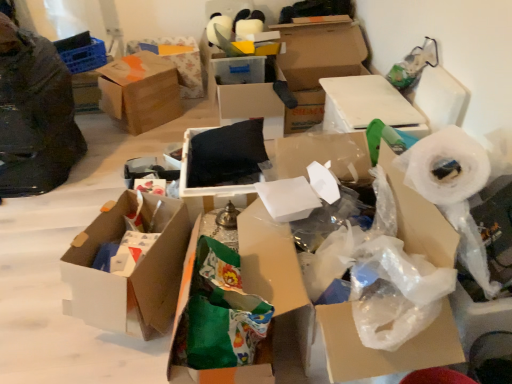
How much space does cardboard box at upper center, which ranks as the second box in right-to-left order, occupy vertically?

cardboard box at upper center, which ranks as the second box in right-to-left order, is 54.04 centimeters in height.

The width and height of the screenshot is (512, 384). Describe the element at coordinates (453, 190) in the screenshot. I see `white plastic roll at right` at that location.

Measure the distance between point (182, 195) and camera.

Point (182, 195) and camera are 6.27 feet apart.

What is the approximate height of white cardboard box at center, which appears as the sixth box when viewed from the left?

It is 15.74 inches.

What is the approximate width of white cardboard box at center, positioned as the 6th box in right-to-left order?

white cardboard box at center, positioned as the 6th box in right-to-left order, is 12.50 inches wide.

The image size is (512, 384). I want to click on brown cardboard box at upper left, marked as the eighth box in a right-to-left arrangement, so click(140, 92).

This screenshot has width=512, height=384. Identify the location of cardboard box at upper center, which ranks as the second box in right-to-left order. (317, 64).

The image size is (512, 384). In order to click on the 3rd box behind the dark green fabric at left in this screenshot , I will do `click(248, 103)`.

From a real-world perspective, is white cardboard box at center, which ranks as the third box in right-to-left order, above or below dark green fabric at left?

From a real-world perspective, white cardboard box at center, which ranks as the third box in right-to-left order, is physically below dark green fabric at left.

Relative to dark green fabric at left, is white cardboard box at center, which ranks as the third box in right-to-left order, in front or behind?

Clearly, white cardboard box at center, which ranks as the third box in right-to-left order, is behind dark green fabric at left.

Is cardboard box at center further to camera compared to green fabric bag at center, acting as the 5th box starting from the left?

No, cardboard box at center is in front of green fabric bag at center, acting as the 5th box starting from the left.

From the image's perspective, between cardboard box at center and green fabric bag at center, acting as the 5th box starting from the left, who is located below?

green fabric bag at center, acting as the 5th box starting from the left, is shown below in the image.

Does cardboard box at center appear on the left side of green fabric bag at center, which ranks as the 4th box in right-to-left order?

No, cardboard box at center is not to the left of green fabric bag at center, which ranks as the 4th box in right-to-left order.

Does point (234, 369) appear closer or farther from the camera than point (407, 235)?

Point (234, 369) is positioned closer to the camera compared to point (407, 235).

Is green fabric bag at center, which ranks as the 4th box in right-to-left order, taller than cardboard box at center?

In fact, green fabric bag at center, which ranks as the 4th box in right-to-left order, may be shorter than cardboard box at center.

Is the surface of green fabric bag at center, which ranks as the 4th box in right-to-left order, in direct contact with cardboard box at center?

No, green fabric bag at center, which ranks as the 4th box in right-to-left order, is not making contact with cardboard box at center.

Between green fabric bag at center, acting as the 5th box starting from the left, and cardboard box at center, which one has smaller size?

green fabric bag at center, acting as the 5th box starting from the left.

Is white cardboard box at center, which ranks as the third box in right-to-left order, positioned with its back to cardboard box at upper center, which ranks as the second box in right-to-left order?

No, white cardboard box at center, which ranks as the third box in right-to-left order,'s orientation is not away from cardboard box at upper center, which ranks as the second box in right-to-left order.

In terms of width, does white cardboard box at center, which appears as the sixth box when viewed from the left, look wider or thinner when compared to cardboard box at upper center, which ranks as the second box in right-to-left order?

In the image, white cardboard box at center, which appears as the sixth box when viewed from the left, appears to be more narrow than cardboard box at upper center, which ranks as the second box in right-to-left order.

Considering the positions of point (269, 114) and point (296, 60), is point (269, 114) closer or farther from the camera than point (296, 60)?

Point (269, 114) appears to be closer to the viewer than point (296, 60).

Is white cardboard box at center, which ranks as the third box in right-to-left order, next to cardboard box at upper center, which ranks as the second box in right-to-left order, and touching it?

No, white cardboard box at center, which ranks as the third box in right-to-left order, is not beside cardboard box at upper center, which ranks as the second box in right-to-left order.

Considering the sizes of objects white plastic roll at right and cardboard box at center in the image provided, who is thinner, white plastic roll at right or cardboard box at center?

With smaller width is white plastic roll at right.

Considering the relative positions of white plastic roll at right and cardboard box at center in the image provided, is white plastic roll at right in front of cardboard box at center?

No, white plastic roll at right is behind cardboard box at center.

This screenshot has width=512, height=384. Identify the location of cardboard box on the left of white plastic roll at right. (329, 310).

Can you confirm if white plastic roll at right is positioned to the right of cardboard box at center?

Yes, white plastic roll at right is to the right of cardboard box at center.

Visually, is black matte pillow at center, acting as the 4th box starting from the left, positioned to the left or to the right of white cardboard box at center, which is counted as the third box, starting from the left?

black matte pillow at center, acting as the 4th box starting from the left, is positioned on white cardboard box at center, which is counted as the third box, starting from the left,'s right side.

Is point (195, 188) in front of point (151, 284)?

No, it is not.

Is white cardboard box at center, positioned as the 6th box in right-to-left order, at the back of black matte pillow at center, acting as the 4th box starting from the left?

No, black matte pillow at center, acting as the 4th box starting from the left, is not facing the opposite direction of white cardboard box at center, positioned as the 6th box in right-to-left order.

Is dark green fabric at left closer to camera compared to black matte pillow at center, the 5th box from the right?

That is True.

Considering the sizes of dark green fabric at left and black matte pillow at center, the 5th box from the right, in the image, is dark green fabric at left wider or thinner than black matte pillow at center, the 5th box from the right,?

dark green fabric at left is wider than black matte pillow at center, the 5th box from the right.

Is dark green fabric at left shorter than black matte pillow at center, the 5th box from the right?

No.

Does dark green fabric at left touch black matte pillow at center, the 5th box from the right?

No, dark green fabric at left is not beside black matte pillow at center, the 5th box from the right.

This screenshot has width=512, height=384. Identify the location of clothing on the left of white cardboard box at center, which ranks as the third box in right-to-left order. (35, 114).

In order to click on cardboard box on the right of green fabric bag at center, acting as the 5th box starting from the left in this screenshot , I will do `click(329, 310)`.

Looking at the image, which one is located further to dark green fabric at left, brown cardboard box at upper left, placed as the 1th box when sorted from left to right, or brown cardboard box at upper center, marked as the 2th box in a left-to-right arrangement?

brown cardboard box at upper center, marked as the 2th box in a left-to-right arrangement, is further to dark green fabric at left.

When comparing their distances from white cardboard box at center, which ranks as the third box in right-to-left order, does white plastic roll at right or white cardboard box at center, positioned as the 6th box in right-to-left order, seem closer?

Among the two, white cardboard box at center, positioned as the 6th box in right-to-left order, is located nearer to white cardboard box at center, which ranks as the third box in right-to-left order.

From the picture: Considering their positions, is white plastic bag at center, the eighth box in the left-to-right sequence, positioned closer to white cardboard box at center, which appears as the sixth box when viewed from the left, than brown cardboard box at upper center, which is the 7th box from right to left?

white plastic bag at center, the eighth box in the left-to-right sequence.

Looking at the image, which one is located closer to black matte pillow at center, acting as the 4th box starting from the left, white cardboard box at center, which appears as the sixth box when viewed from the left, or white cardboard box at center, positioned as the 6th box in right-to-left order?

Among the two, white cardboard box at center, positioned as the 6th box in right-to-left order, is located nearer to black matte pillow at center, acting as the 4th box starting from the left.

In the scene shown: Based on their spatial positions, is cardboard box at upper center, which ranks as the second box in right-to-left order, or white cardboard box at center, which ranks as the third box in right-to-left order, further from white plastic bag at center, the first box in the right-to-left sequence?

The object further to white plastic bag at center, the first box in the right-to-left sequence, is white cardboard box at center, which ranks as the third box in right-to-left order.

From the image, which object appears to be nearer to white plastic roll at right, white cardboard box at center, positioned as the 6th box in right-to-left order, or cardboard box at upper center, which ranks as the second box in right-to-left order?

Based on the image, white cardboard box at center, positioned as the 6th box in right-to-left order, appears to be nearer to white plastic roll at right.

Consider the image. Estimate the real-world distances between objects in this image. Which object is closer to dark green fabric at left, white cardboard box at center, positioned as the 6th box in right-to-left order, or cardboard box at center?

white cardboard box at center, positioned as the 6th box in right-to-left order.

Considering their positions, is cardboard box at upper center, arranged as the 7th box when viewed from the left, positioned further to black matte pillow at center, the 5th box from the right, than white cardboard box at center, which appears as the sixth box when viewed from the left?

cardboard box at upper center, arranged as the 7th box when viewed from the left, lies further to black matte pillow at center, the 5th box from the right, than the other object.

Find the location of `cardboard box between white cardboard box at center, which is counted as the third box, starting from the left, and white plastic roll at right`. cardboard box between white cardboard box at center, which is counted as the third box, starting from the left, and white plastic roll at right is located at coordinates (329, 310).

Where is `clothing located between white cardboard box at center, positioned as the 6th box in right-to-left order, and brown cardboard box at upper left, placed as the 1th box when sorted from left to right, in the depth direction`? The height and width of the screenshot is (384, 512). clothing located between white cardboard box at center, positioned as the 6th box in right-to-left order, and brown cardboard box at upper left, placed as the 1th box when sorted from left to right, in the depth direction is located at coordinates (35, 114).

Locate an element on the screen. cardboard box situated between dark green fabric at left and white plastic bag at center, the eighth box in the left-to-right sequence, from left to right is located at coordinates (329, 310).

Locate an element on the screen. The width and height of the screenshot is (512, 384). toilet paper positioned between cardboard box at center and white plastic bag at center, the eighth box in the left-to-right sequence, from near to far is located at coordinates (453, 190).